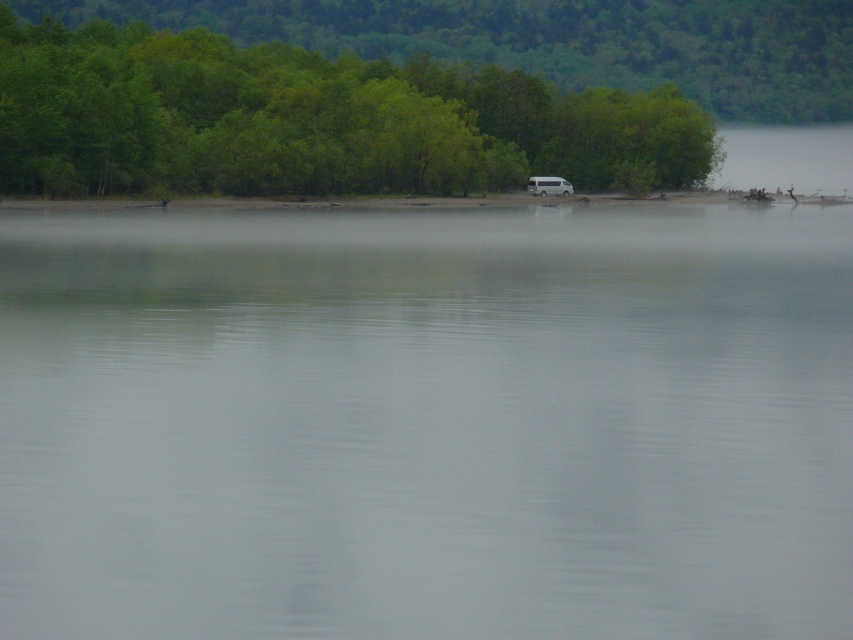
Which is more to the left, green leafy trees at upper center or white matte van at center?

Answer: From the viewer's perspective, green leafy trees at upper center appears more on the left side.

Which is behind, point (564, 177) or point (541, 192)?

Point (564, 177)

This screenshot has width=853, height=640. I want to click on green leafy trees at upper center, so click(x=310, y=120).

I want to click on green leafy trees at upper center, so click(x=310, y=120).

Is clear water at center bigger than white matte van at center?

Yes.

Does clear water at center have a greater height compared to white matte van at center?

Correct, clear water at center is much taller as white matte van at center.

From the picture: Who is more forward, [386,476] or [541,188]?

Point [386,476] is more forward.

This screenshot has height=640, width=853. I want to click on clear water at center, so click(427, 422).

Is point (581, 246) farther from camera compared to point (32, 179)?

No, it is in front of (32, 179).

Can you confirm if clear water at center is bigger than green leafy trees at upper center?

No.

Who is more forward, (820,470) or (479,186)?

Positioned in front is point (820,470).

Where is `clear water at center`? The width and height of the screenshot is (853, 640). clear water at center is located at coordinates (427, 422).